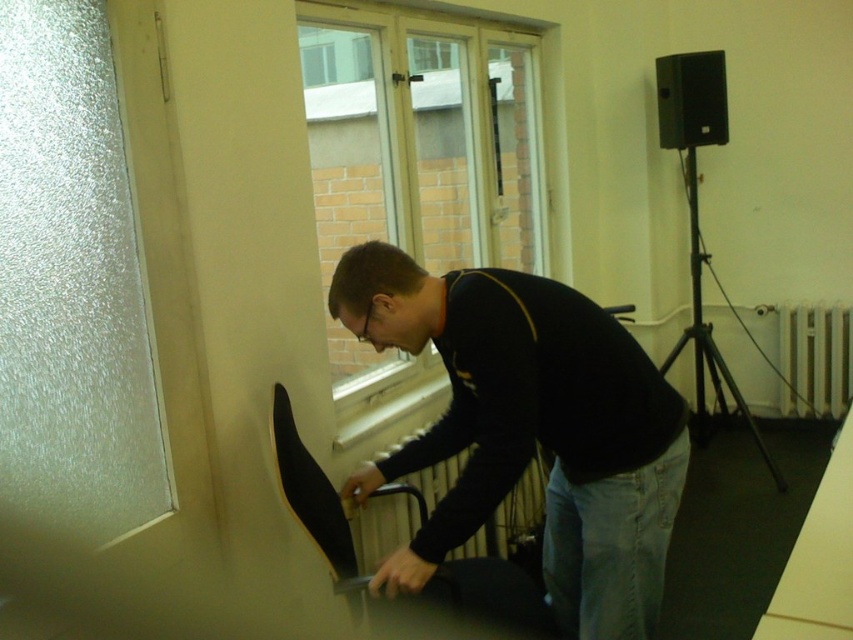
Question: Which point is closer to the camera?

Choices:
 (A) (424, 540)
 (B) (813, 317)
 (C) (550, 493)

Answer: (A)

Question: Does clear glass window at upper center lie behind black matte tripod at right?

Choices:
 (A) no
 (B) yes

Answer: (A)

Question: Which of the following is the farthest from the observer?

Choices:
 (A) (372, 518)
 (B) (358, 54)

Answer: (B)

Question: Which point appears farthest from the camera in this image?

Choices:
 (A) (440, 524)
 (B) (699, 435)

Answer: (B)

Question: Is clear glass window at upper center wider than black matte tripod at right?

Choices:
 (A) no
 (B) yes

Answer: (B)

Question: Is clear glass window at upper center positioned before metallic radiator at center?

Choices:
 (A) yes
 (B) no

Answer: (B)